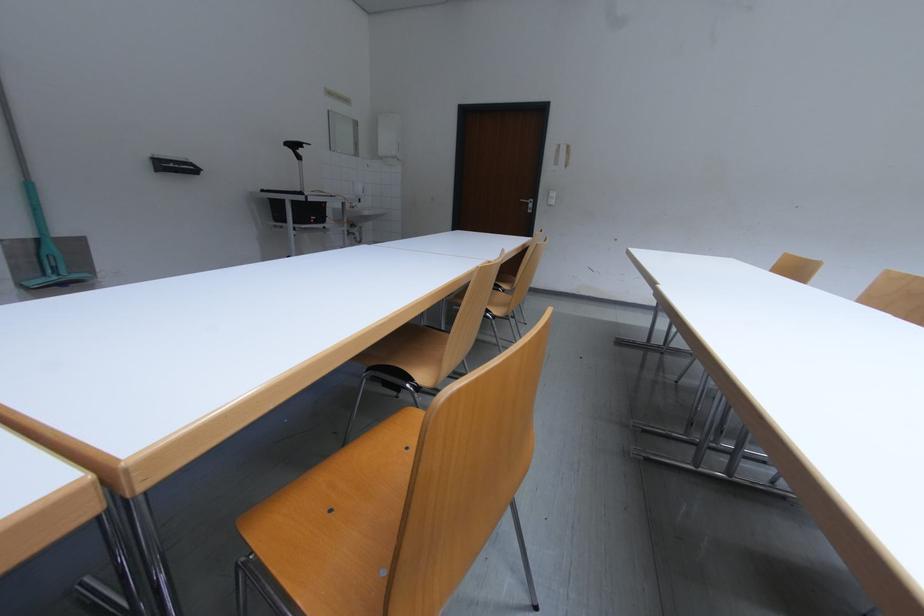
This screenshot has width=924, height=616. What are the coordinates of `green mop` in the screenshot? It's located at (38, 217).